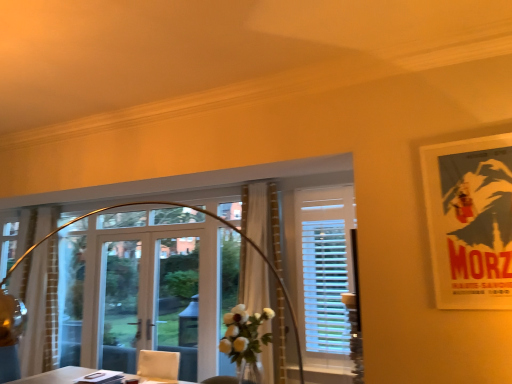
Question: In terms of width, does clear glass door at center look wider or thinner when compared to white sheer curtain at center, the 1th curtain positioned from the right?

Choices:
 (A) thin
 (B) wide

Answer: (A)

Question: From their relative heights in the image, would you say clear glass door at center is taller or shorter than white sheer curtain at center, the 1th curtain positioned from the right?

Choices:
 (A) short
 (B) tall

Answer: (A)

Question: Based on their relative distances, which object is farther from the white sheer curtain at center, the second curtain in the left-to-right sequence?

Choices:
 (A) white sheer curtain at left, the 1th curtain positioned from the left
 (B) white plastic blinds at center, which is the 2th window from left to right
 (C) clear glass door at center
 (D) transparent glass window at center, the second window when ordered from back to front
 (E) matte paper poster at upper right

Answer: (A)

Question: Which is nearer to the matte paper poster at upper right?

Choices:
 (A) white sheer curtain at left, positioned as the 1th curtain in back-to-front order
 (B) transparent glass window at center, which is counted as the first window, starting from the left
 (C) clear glass door at center
 (D) white plastic blinds at center, placed as the 2th window when sorted from front to back
 (E) white sheer curtain at center, the second curtain in the left-to-right sequence

Answer: (B)